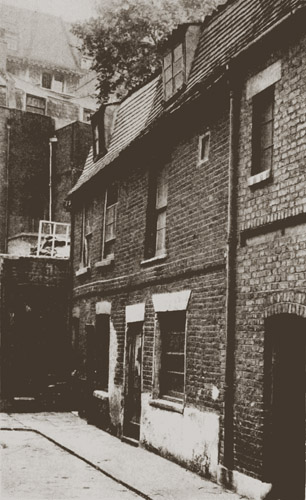
The width and height of the screenshot is (306, 500). In order to click on bottom floor window in this screenshot , I will do `click(102, 352)`, `click(177, 353)`.